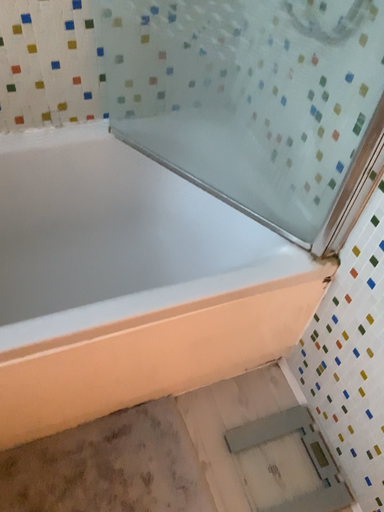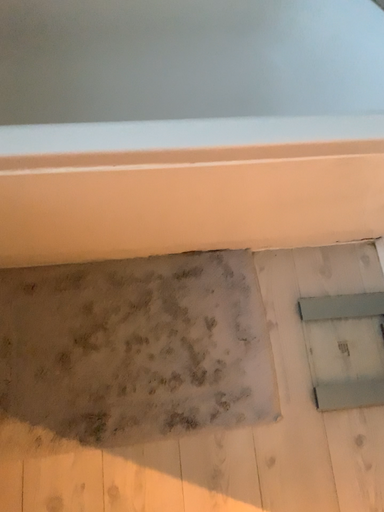
Question: Which way did the camera rotate in the video?

Choices:
 (A) rotated downward
 (B) rotated upward

Answer: (A)